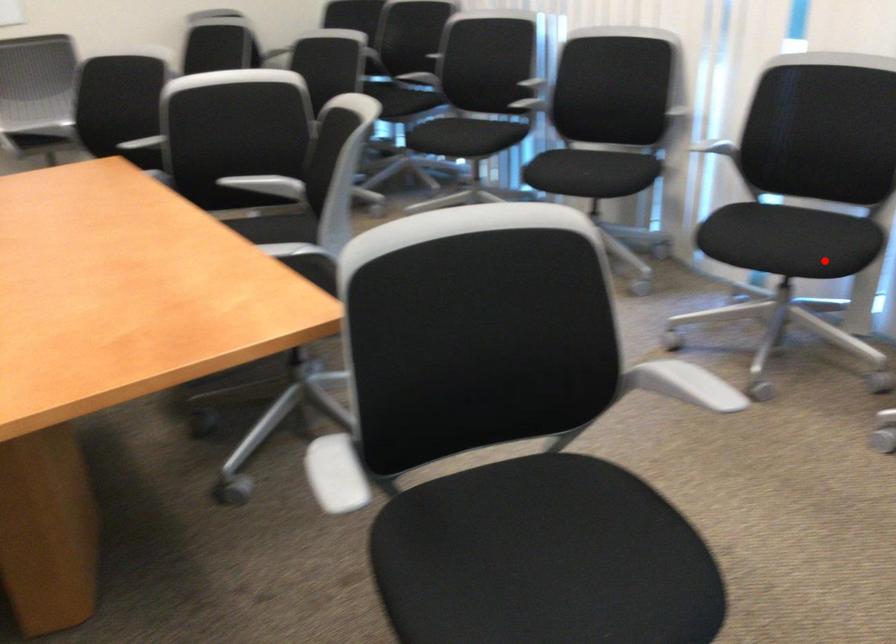
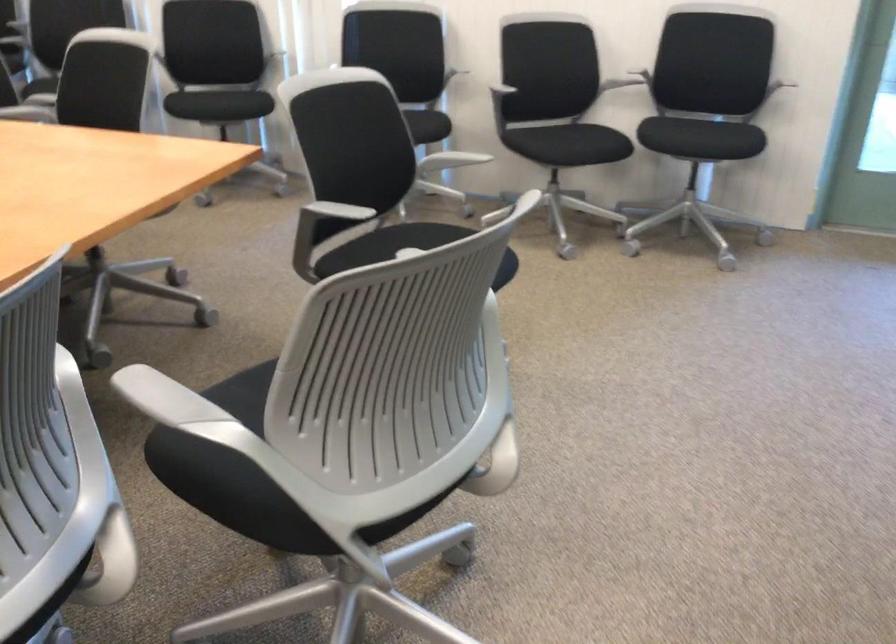
Question: I am providing you with two images of the same scene from different viewpoints. A red point is shown in image1. For the corresponding object point in image2, is it positioned nearer or farther from the camera?

Choices:
 (A) Nearer
 (B) Farther

Answer: (B)